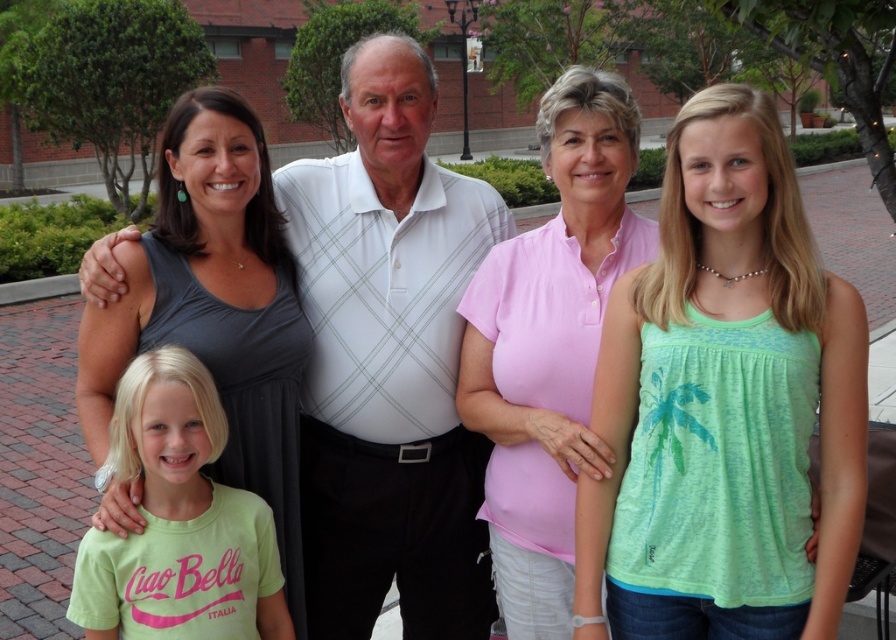
Does green fabric tank top at center appear on the left side of white textured polo shirt at center?

In fact, green fabric tank top at center is to the right of white textured polo shirt at center.

Does green fabric tank top at center appear over white textured polo shirt at center?

No, green fabric tank top at center is not above white textured polo shirt at center.

From the picture: Measure the distance between point (607, 420) and camera.

The distance of point (607, 420) from camera is 7.28 feet.

The image size is (896, 640). Identify the location of green fabric tank top at center. (724, 403).

Between point (248, 285) and point (157, 426), which one is positioned in front?

Point (157, 426) is more forward.

Is the position of gray matte tank top at left less distant than that of green cotton shirt at lower left?

No.

This screenshot has width=896, height=640. Identify the location of gray matte tank top at left. (214, 307).

Locate an element on the screen. The height and width of the screenshot is (640, 896). gray matte tank top at left is located at coordinates (214, 307).

Describe the element at coordinates (724, 403) in the screenshot. I see `green fabric tank top at center` at that location.

Can you confirm if green fabric tank top at center is positioned to the right of pink cotton shirt at center?

Yes, green fabric tank top at center is to the right of pink cotton shirt at center.

Identify the location of green fabric tank top at center. This screenshot has width=896, height=640. coord(724,403).